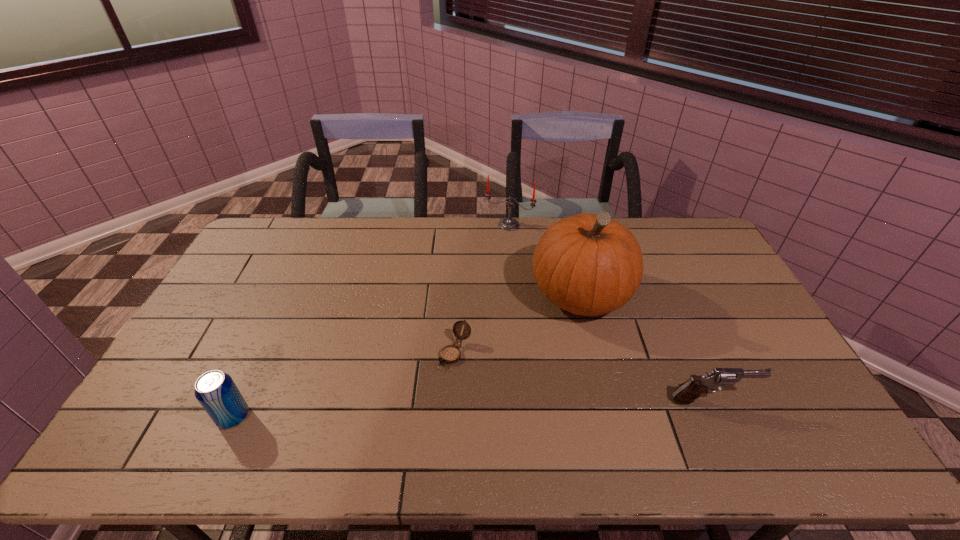
Find the location of a particular element. beer can situated at the near edge is located at coordinates (215, 390).

Where is `pistol that is at the near edge`? The image size is (960, 540). pistol that is at the near edge is located at coordinates (687, 392).

The image size is (960, 540). Find the location of `object that is at the right edge`. object that is at the right edge is located at coordinates (687, 392).

What are the coordinates of `object that is at the near right corner` in the screenshot? It's located at (687, 392).

This screenshot has height=540, width=960. In order to click on vacant space at the far edge of the desktop in this screenshot , I will do `click(336, 237)`.

The height and width of the screenshot is (540, 960). Identify the location of free space at the near edge of the desktop. (342, 406).

Find the location of a particular element. The width and height of the screenshot is (960, 540). free region at the left edge of the desktop is located at coordinates (225, 296).

You are a GUI agent. You are given a task and a screenshot of the screen. Output one action in this format:
    pyautogui.click(x=<x>, y=<y>)
    Task: Click on the free space at the right edge of the desktop
    
    Given the screenshot: What is the action you would take?
    pyautogui.click(x=757, y=368)

In the image, there is a desktop. Where is `vacant space at the far right corner`? Image resolution: width=960 pixels, height=540 pixels. vacant space at the far right corner is located at coordinates (691, 226).

You are a GUI agent. You are given a task and a screenshot of the screen. Output one action in this format:
    pyautogui.click(x=<x>, y=<y>)
    Task: Click on the free region at the near right corner
    The width and height of the screenshot is (960, 540).
    Given the screenshot: What is the action you would take?
    pyautogui.click(x=767, y=402)